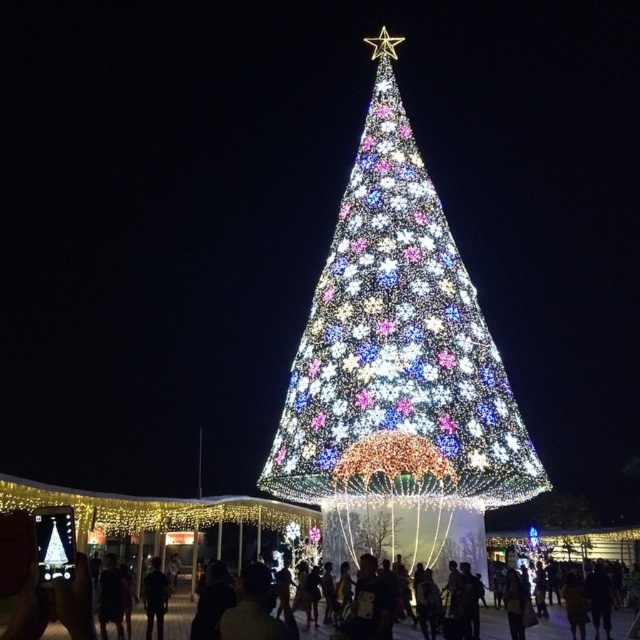
Is point (428, 186) in front of point (54, 600)?

That is False.

What do you see at coordinates (397, 371) in the screenshot? This screenshot has width=640, height=640. I see `illuminated plastic christmas tree at center` at bounding box center [397, 371].

The height and width of the screenshot is (640, 640). I want to click on illuminated plastic christmas tree at center, so click(x=397, y=371).